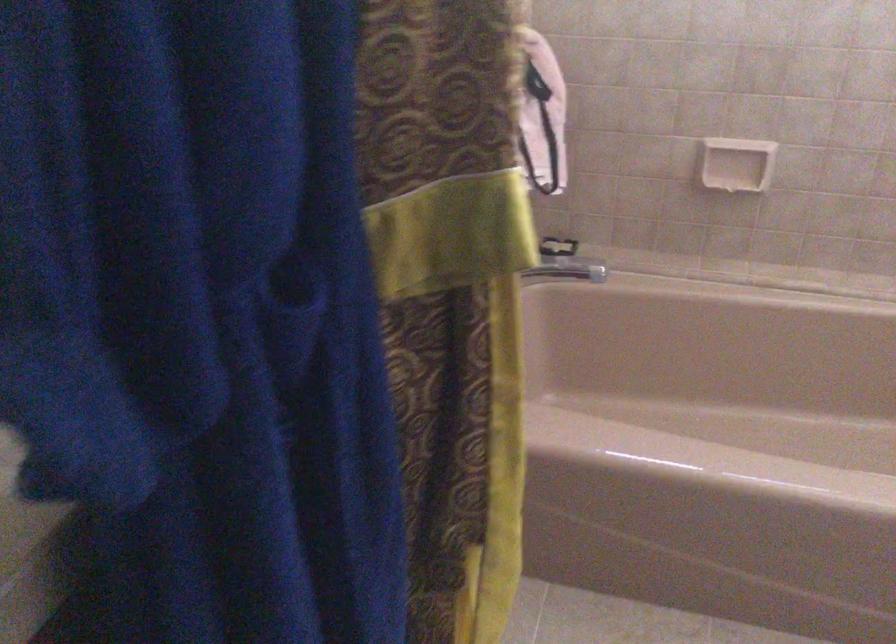
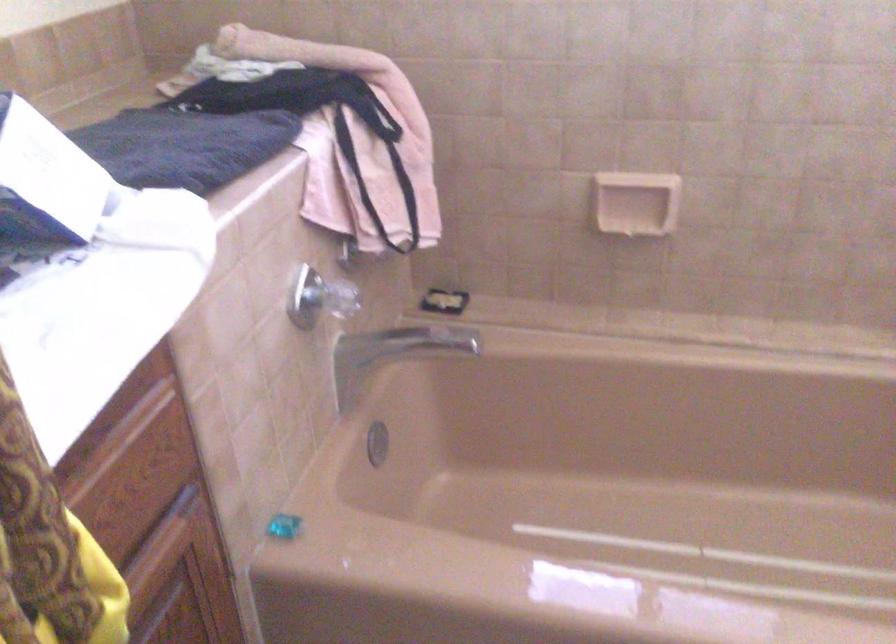
Question: The first image is from the beginning of the video and the second image is from the end. How did the camera likely rotate when shooting the video?

Choices:
 (A) Left
 (B) Right
 (C) Up
 (D) Down

Answer: (B)